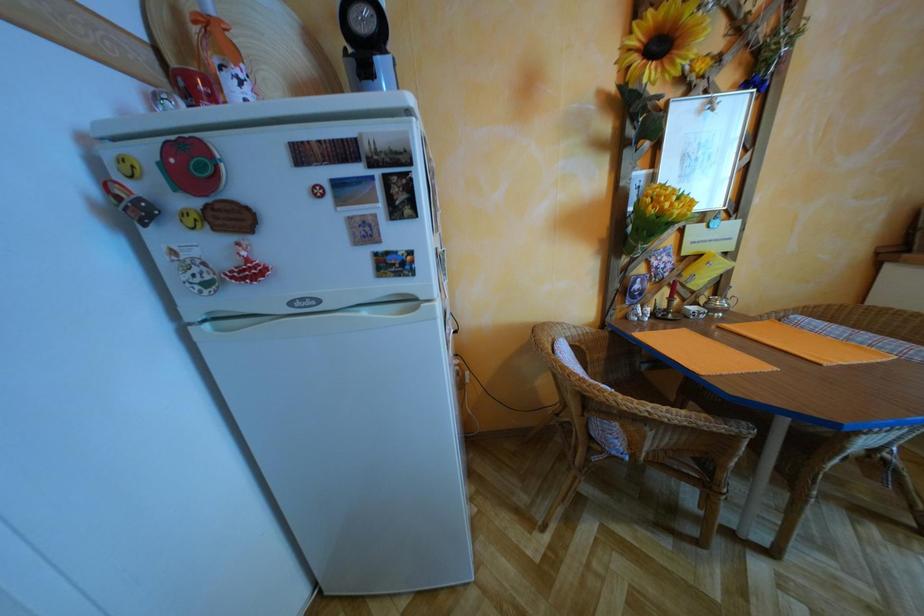
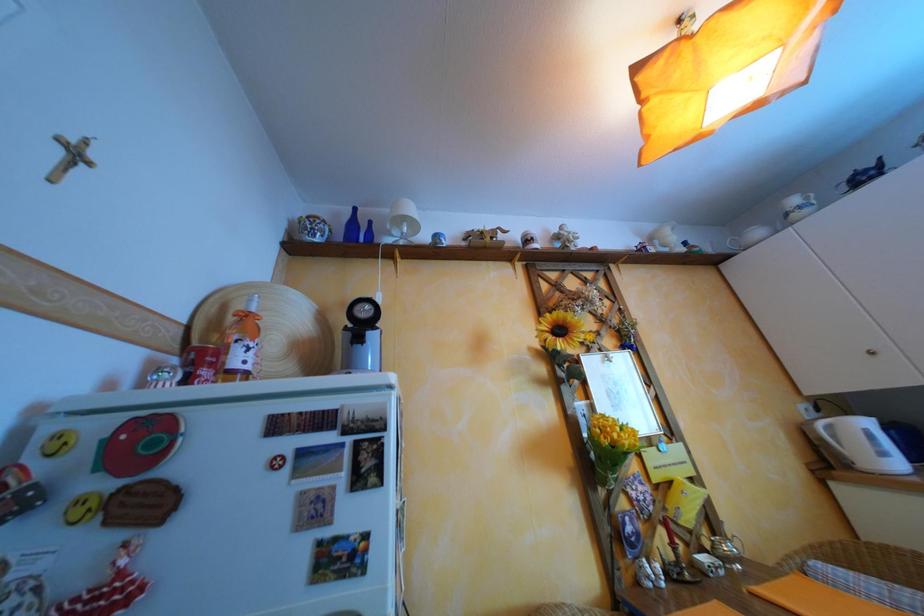
Question: The first image is from the beginning of the video and the second image is from the end. How did the camera likely rotate when shooting the video?

Choices:
 (A) Left
 (B) Right
 (C) Up
 (D) Down

Answer: (C)